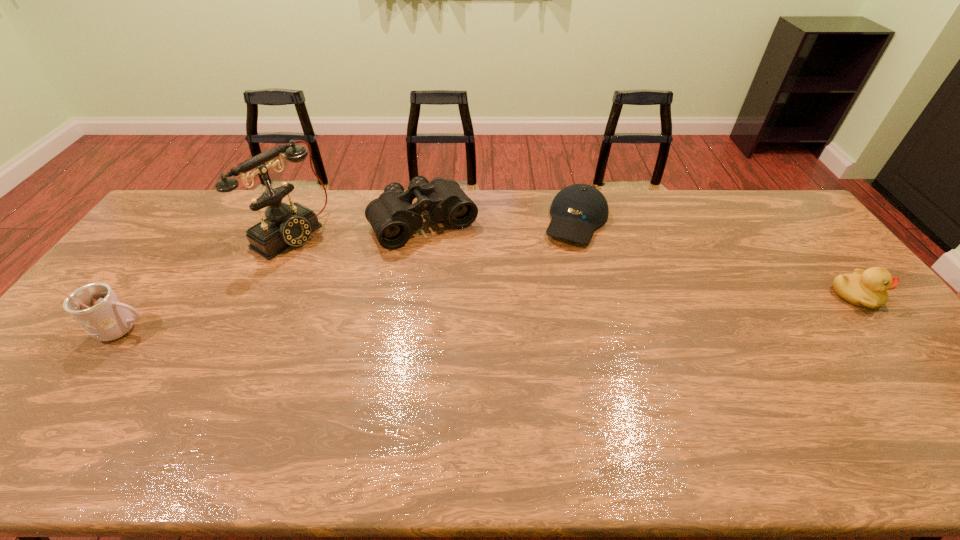
This screenshot has width=960, height=540. I want to click on the leftmost object, so click(x=96, y=307).

The image size is (960, 540). Find the location of `the second tallest object`. the second tallest object is located at coordinates (96, 307).

At what (x,y) coordinates should I click in order to perform the action: click on the rightmost object. Please return your answer as a coordinate pair (x, y). The image size is (960, 540). Looking at the image, I should click on (867, 288).

Find the location of `duckling`. duckling is located at coordinates (867, 288).

Where is `the third tallest object`? The width and height of the screenshot is (960, 540). the third tallest object is located at coordinates (393, 217).

Find the location of a particular element. This screenshot has height=540, width=960. binoculars is located at coordinates (393, 217).

The height and width of the screenshot is (540, 960). I want to click on the tallest object, so click(285, 225).

Find the location of `the second object from left to right`. the second object from left to right is located at coordinates (285, 225).

Locate an element on the screen. The height and width of the screenshot is (540, 960). the fourth object from left to right is located at coordinates (577, 210).

This screenshot has width=960, height=540. I want to click on vacant space located on the side with the handle of the nearest object, so click(189, 330).